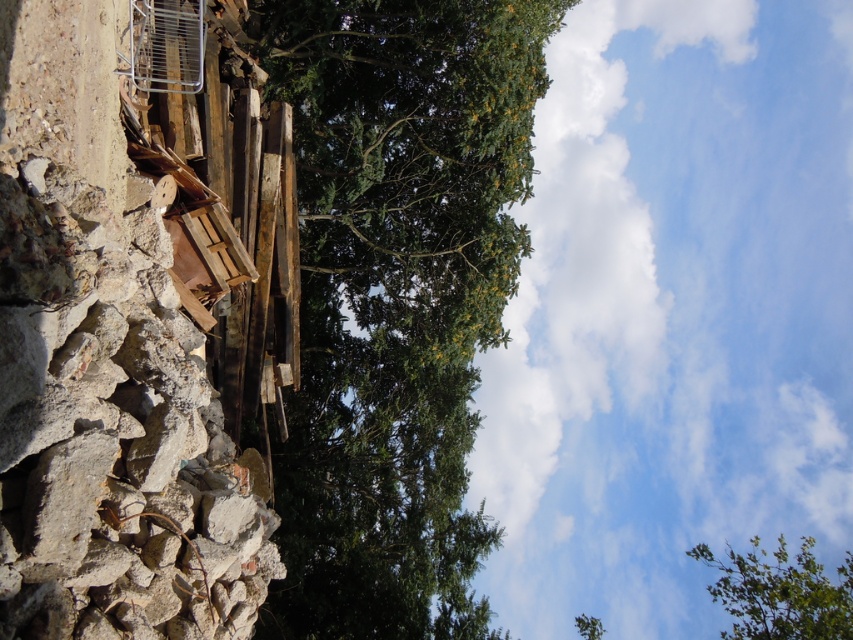
Question: Which point is closer to the camera taking this photo?

Choices:
 (A) (250, 490)
 (B) (332, 182)
 (C) (788, 600)

Answer: (A)

Question: Which of the following is the closest to the observer?

Choices:
 (A) rough concrete cliff at left
 (B) green leafy tree at center

Answer: (A)

Question: Can you confirm if rough concrete cliff at left is positioned to the left of green leafy tree at upper center?

Choices:
 (A) no
 (B) yes

Answer: (B)

Question: Is rough concrete cliff at left above green leafy tree at upper center?

Choices:
 (A) yes
 (B) no

Answer: (A)

Question: Does green leafy tree at center have a smaller size compared to green leafy tree at upper center?

Choices:
 (A) yes
 (B) no

Answer: (A)

Question: Which point is farther from the camera taking this photo?

Choices:
 (A) (796, 614)
 (B) (120, 376)
 (C) (293, 432)

Answer: (A)